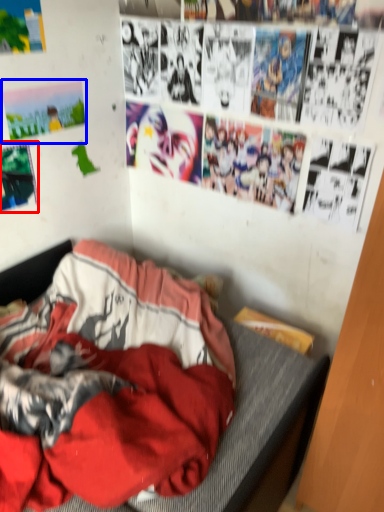
Question: Among these objects, which one is farthest to the camera, poster page (highlighted by a red box) or poster page (highlighted by a blue box)?

Choices:
 (A) poster page
 (B) poster page

Answer: (B)